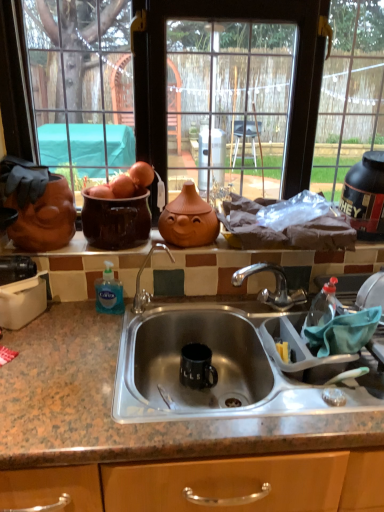
Question: Is granite countertop at center taller or shorter than matte glass window at upper center?

Choices:
 (A) short
 (B) tall

Answer: (A)

Question: Considering the relative positions of granite countertop at center and matte glass window at upper center in the image provided, is granite countertop at center to the left or to the right of matte glass window at upper center?

Choices:
 (A) left
 (B) right

Answer: (B)

Question: Estimate the real-world distances between objects in this image. Which object is closer to the granite countertop at center?

Choices:
 (A) black rubber protein container at upper right
 (B) matte glass window at upper center
 (C) blue translucent liquid soap at sink left

Answer: (C)

Question: Which of these objects is positioned farthest from the matte glass window at upper center?

Choices:
 (A) black rubber protein container at upper right
 (B) granite countertop at center
 (C) blue translucent liquid soap at sink left

Answer: (B)